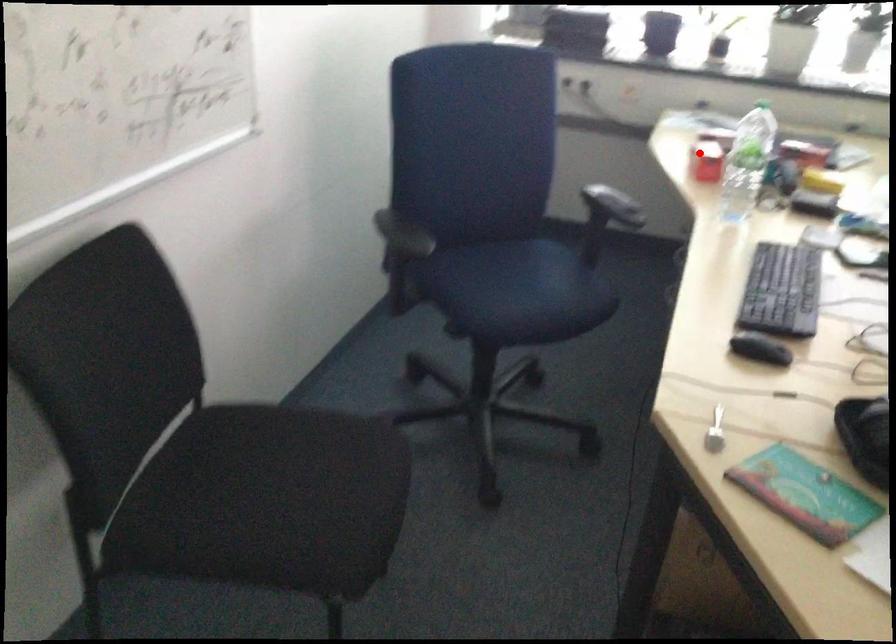
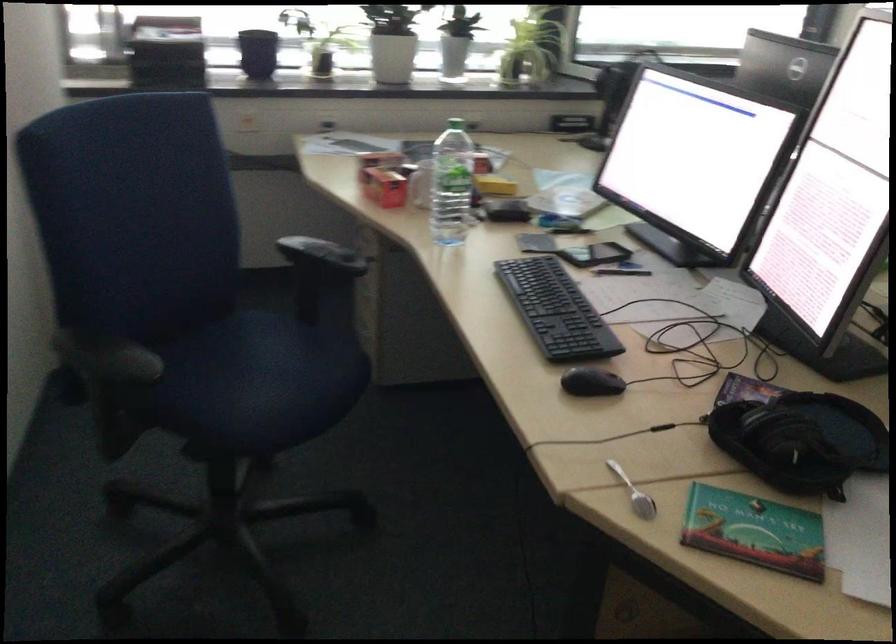
In the second image, find the point that corresponds to the highlighted location in the first image.

(383, 185)